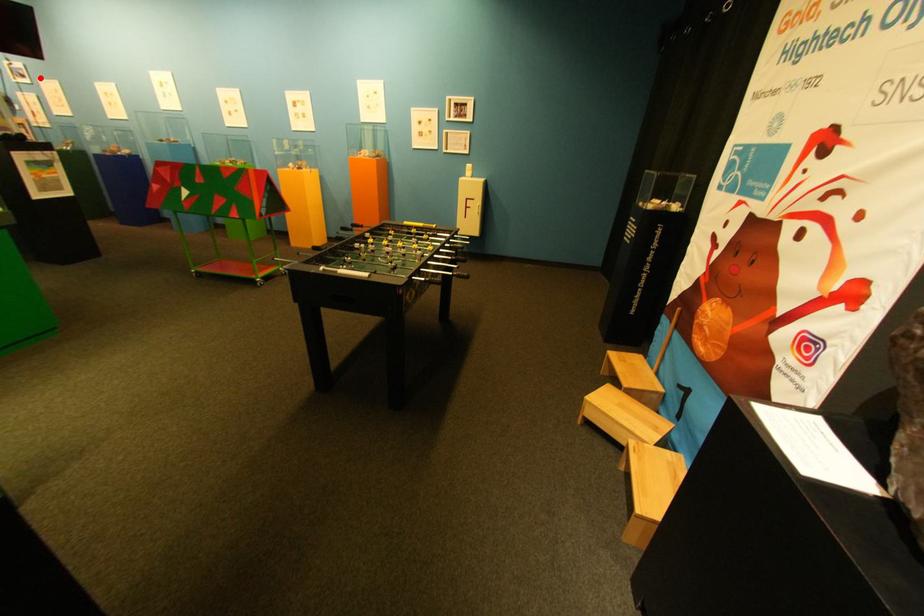
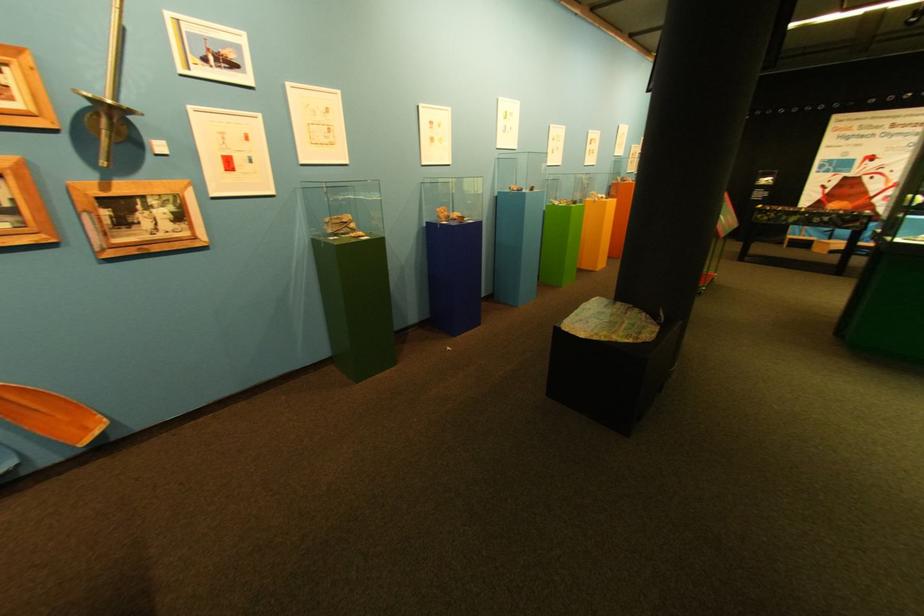
The point at the highlighted location is marked in the first image. Where is the corresponding point in the second image?

(248, 67)